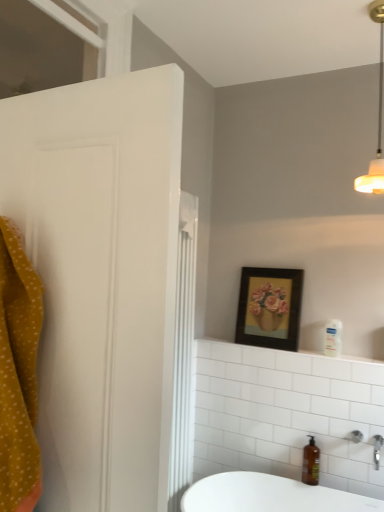
You are a GUI agent. You are given a task and a screenshot of the screen. Output one action in this format:
    pyautogui.click(x=<x>, y=<y>)
    Task: Click on the blank space above white glossy shelf at upper center (from a real-world perspective)
    This screenshot has width=384, height=512.
    Given the screenshot: What is the action you would take?
    pyautogui.click(x=295, y=345)